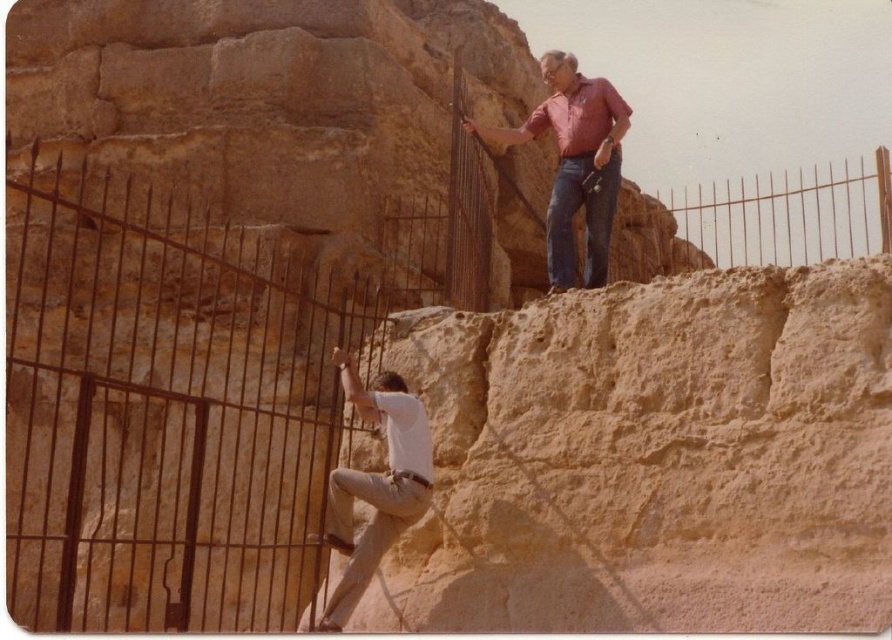
Can you confirm if rusty metal fence at left is shorter than matte red shirt at upper right?

In fact, rusty metal fence at left may be taller than matte red shirt at upper right.

Who is shorter, rusty metal fence at left or matte red shirt at upper right?

With less height is matte red shirt at upper right.

Locate an element on the screen. The height and width of the screenshot is (640, 892). rusty metal fence at left is located at coordinates click(x=175, y=401).

Is matte red shirt at upper right thinner than white cotton shirt at center?

No, matte red shirt at upper right is not thinner than white cotton shirt at center.

Is matte red shirt at upper right further to camera compared to white cotton shirt at center?

That is True.

Is point (525, 140) closer to viewer compared to point (424, 428)?

No, it is behind (424, 428).

Locate an element on the screen. matte red shirt at upper right is located at coordinates (574, 163).

Between brown metal fence at upper right and matte red shirt at upper right, which one is positioned higher?

brown metal fence at upper right is above.

The height and width of the screenshot is (640, 892). I want to click on brown metal fence at upper right, so click(789, 212).